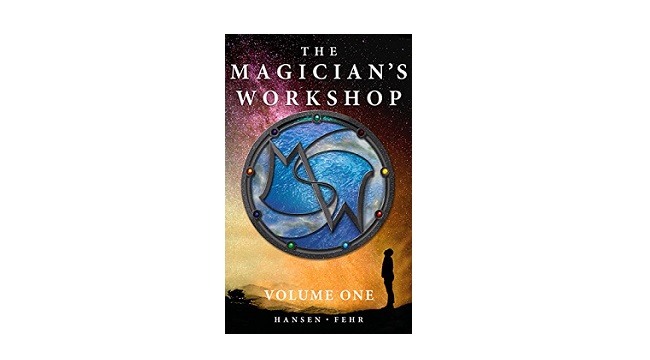
Find the location of a particular element. This screenshot has height=360, width=650. book is located at coordinates (279, 283).